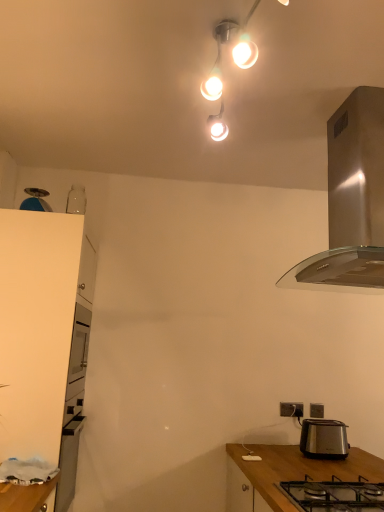
Question: In the image, is black metal/glass gas stove at lower center on the left side or the right side of satin silver range hood at upper right?

Choices:
 (A) left
 (B) right

Answer: (A)

Question: Is black metal/glass gas stove at lower center wider or thinner than satin silver range hood at upper right?

Choices:
 (A) wide
 (B) thin

Answer: (B)

Question: Based on their relative distances, which object is nearer to the white matte cabinet at left?

Choices:
 (A) satin silver toaster at lower right
 (B) satin silver range hood at upper right
 (C) matte white light fixture at upper center
 (D) black plastic power outlet at lower right, acting as the 2th power outlet starting from the right
 (E) matte black power outlet at lower right, which is the 1th power outlet from right to left

Answer: (C)

Question: Estimate the real-world distances between objects in this image. Which object is closer to the black metal/glass gas stove at lower center?

Choices:
 (A) satin silver range hood at upper right
 (B) matte white light fixture at upper center
 (C) satin silver toaster at lower right
 (D) matte black power outlet at lower right, acting as the 2th power outlet starting from the left
 (E) white matte cabinet at left

Answer: (C)